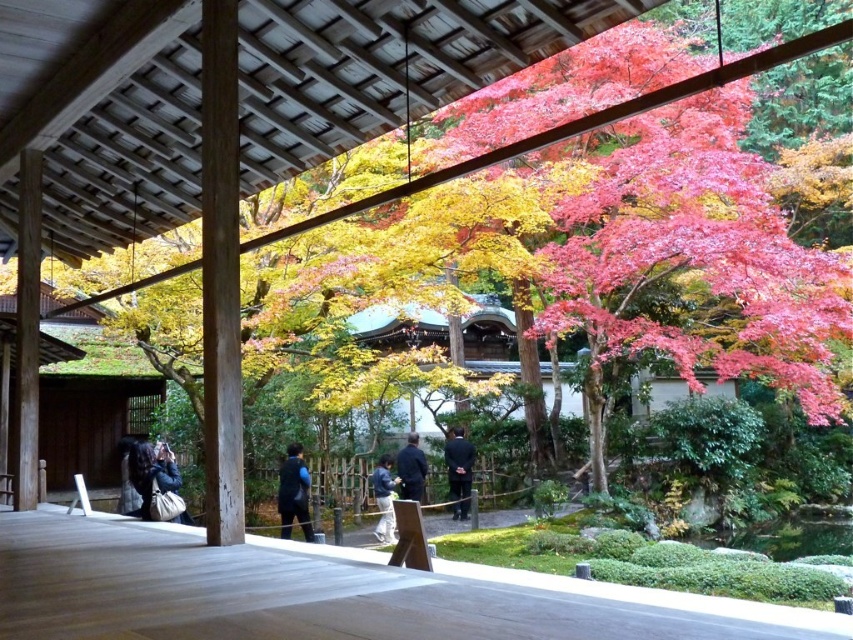
You are standing in the traditional Japanese garden and want to reach a specific point marked at coordinates point (134, 477). If you can walk 1.2 meters per second, how long will it take you to reach that point?

The distance of point (134, 477) from viewer is 7.90 meters. At a walking speed of 1.2 meters per second, it will take approximately 6.58 seconds to reach the point.